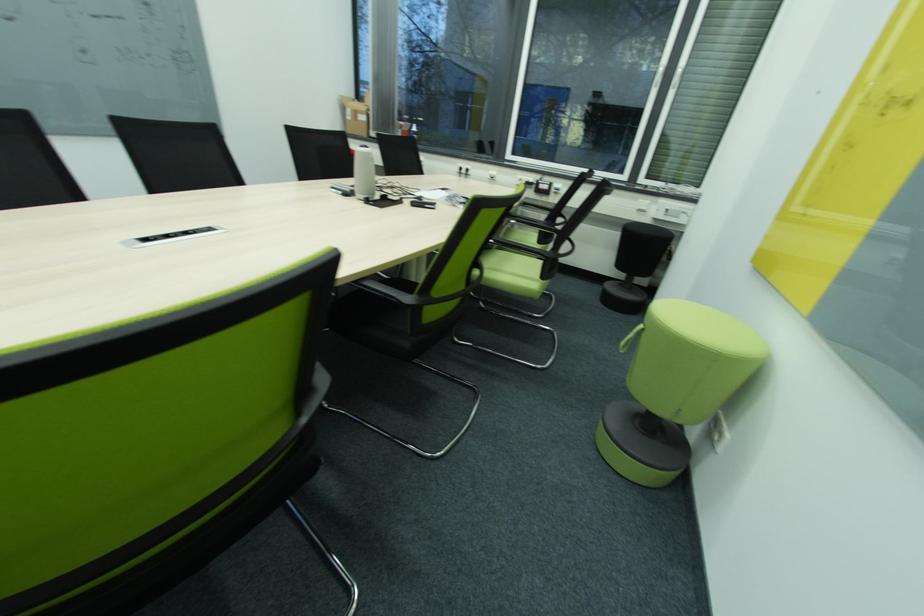
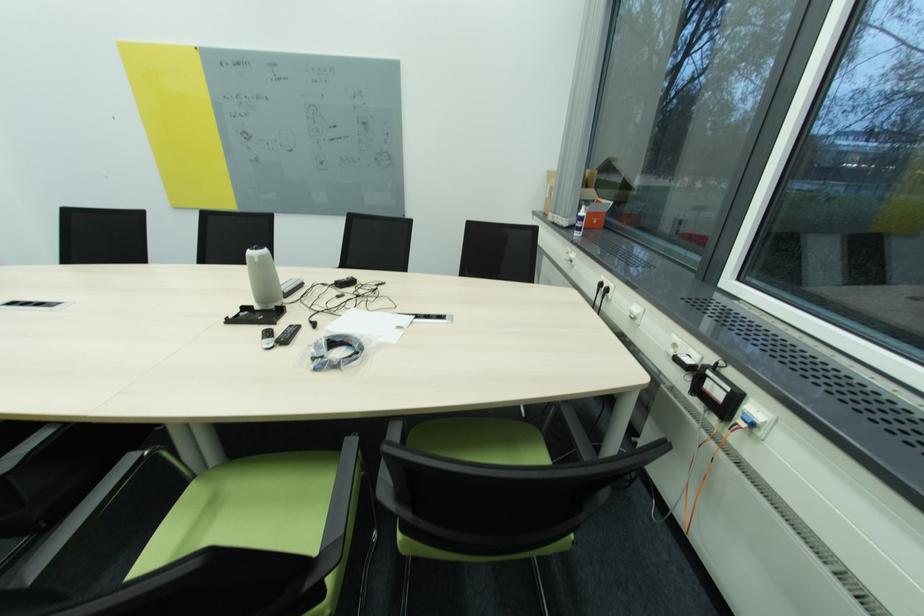
The point at (466, 169) is marked in the first image. Where is the corresponding point in the second image?

(604, 286)